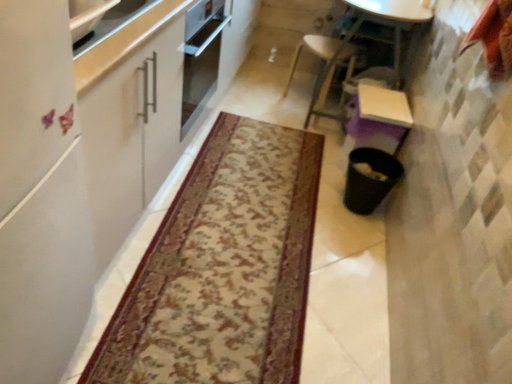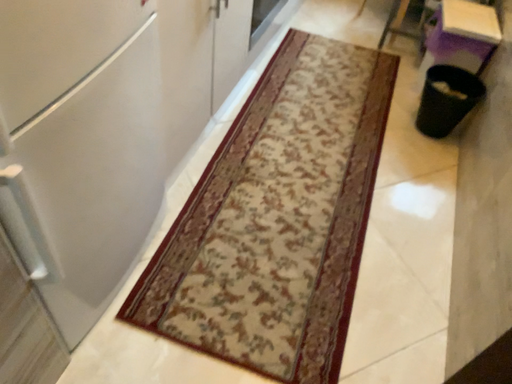
Question: Which way did the camera rotate in the video?

Choices:
 (A) rotated downward
 (B) rotated upward

Answer: (A)